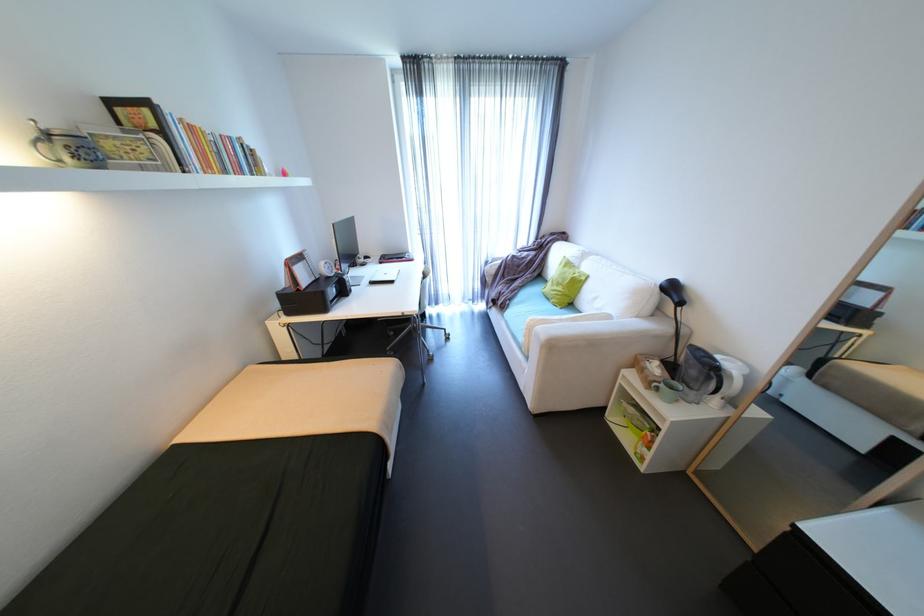
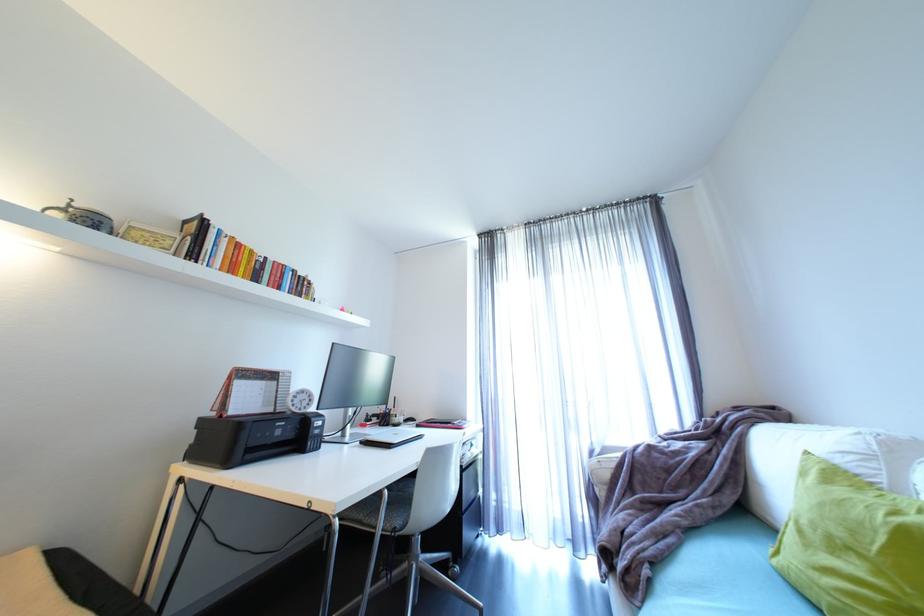
The point at (422, 315) is marked in the first image. Where is the corresponding point in the second image?

(344, 522)